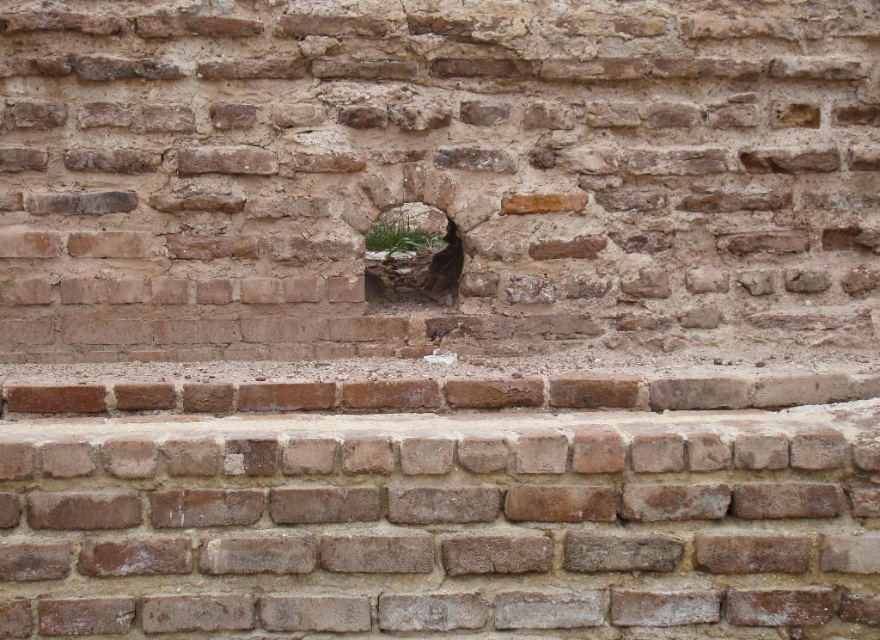
Question: Which point is closer to the camera taking this photo?

Choices:
 (A) (368, 234)
 (B) (444, 269)

Answer: (A)

Question: Which point is closer to the camera?

Choices:
 (A) (402, 256)
 (B) (400, 244)

Answer: (A)

Question: Is green mossy rock at center below green grass at center?

Choices:
 (A) no
 (B) yes

Answer: (B)

Question: Is the position of green mossy rock at center less distant than that of green grass at center?

Choices:
 (A) yes
 (B) no

Answer: (A)

Question: Is green mossy rock at center thinner than green grass at center?

Choices:
 (A) no
 (B) yes

Answer: (A)